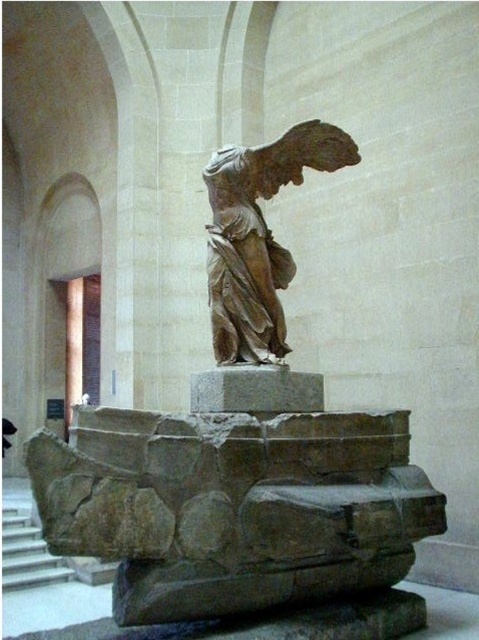
You are a visitor in the museum and want to take a photo of the matte bronze statue at center from the bottom of the white marble stairs at lower left. Is the statue visible from that position?

The matte bronze statue at center is located above the white marble stairs at lower left, so yes, it is visible from the bottom of the stairs.

You are a visitor at the museum and want to take a photo of the matte bronze statue at center from the bottom of the white marble stairs at lower left. Is the statue visible from that position?

The matte bronze statue at center is positioned on the right side of white marble stairs at lower left, so yes, the statue is visible from the bottom of the white marble stairs at lower left.

Based on the photo, you are standing in a museum and want to take a photo of the matte bronze statue at center. The museum requires visitors to stand exactly at point (259, 236) to capture the statue in the correct perspective. Where should you position yourself to take the photo?

You should position yourself at point (259, 236) to take the photo of the matte bronze statue at center as required by the museum.